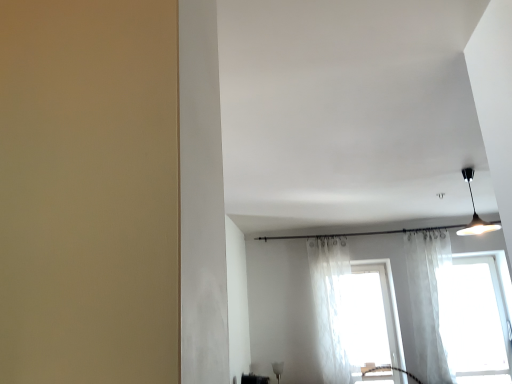
Question: From the image's perspective, is translucent white curtain at center, the second curtain positioned from the right, on top of white sheer curtain at right, the 1th curtain when ordered from right to left?

Choices:
 (A) yes
 (B) no

Answer: (B)

Question: Is translucent white curtain at center, the second curtain positioned from the right, positioned far away from white sheer curtain at right, the 1th curtain when ordered from right to left?

Choices:
 (A) yes
 (B) no

Answer: (B)

Question: Is translucent white curtain at center, the second curtain positioned from the right, oriented away from white sheer curtain at right, the 1th curtain when ordered from right to left?

Choices:
 (A) yes
 (B) no

Answer: (B)

Question: Does translucent white curtain at center, the first curtain from the left, turn towards white sheer curtain at right, the 1th curtain when ordered from right to left?

Choices:
 (A) no
 (B) yes

Answer: (A)

Question: From the image's perspective, is translucent white curtain at center, the first curtain from the left, below white sheer curtain at right, which ranks as the 2th curtain in left-to-right order?

Choices:
 (A) yes
 (B) no

Answer: (A)

Question: Can you confirm if translucent white curtain at center, the first curtain from the left, is smaller than white sheer curtain at right, the 1th curtain when ordered from right to left?

Choices:
 (A) no
 (B) yes

Answer: (A)

Question: Considering the relative sizes of black glossy shelf at lower center and transparent fabric window at right, the 2th window from the left, in the image provided, is black glossy shelf at lower center taller than transparent fabric window at right, the 2th window from the left,?

Choices:
 (A) yes
 (B) no

Answer: (B)

Question: Is black glossy shelf at lower center positioned beyond the bounds of transparent fabric window at right, the 2th window from the left?

Choices:
 (A) yes
 (B) no

Answer: (A)

Question: Is transparent fabric window at right, arranged as the first window when viewed from the right, surrounded by black glossy shelf at lower center?

Choices:
 (A) yes
 (B) no

Answer: (B)

Question: Is black glossy shelf at lower center positioned in front of transparent fabric window at right, the 2th window from the left?

Choices:
 (A) yes
 (B) no

Answer: (B)

Question: From the image's perspective, would you say black glossy shelf at lower center is positioned over transparent fabric window at right, arranged as the first window when viewed from the right?

Choices:
 (A) yes
 (B) no

Answer: (B)

Question: Can you confirm if black glossy shelf at lower center is thinner than transparent fabric window at right, the 2th window from the left?

Choices:
 (A) no
 (B) yes

Answer: (B)

Question: Is black glossy shelf at lower center aimed at translucent white curtain at center, the second curtain positioned from the right?

Choices:
 (A) no
 (B) yes

Answer: (B)